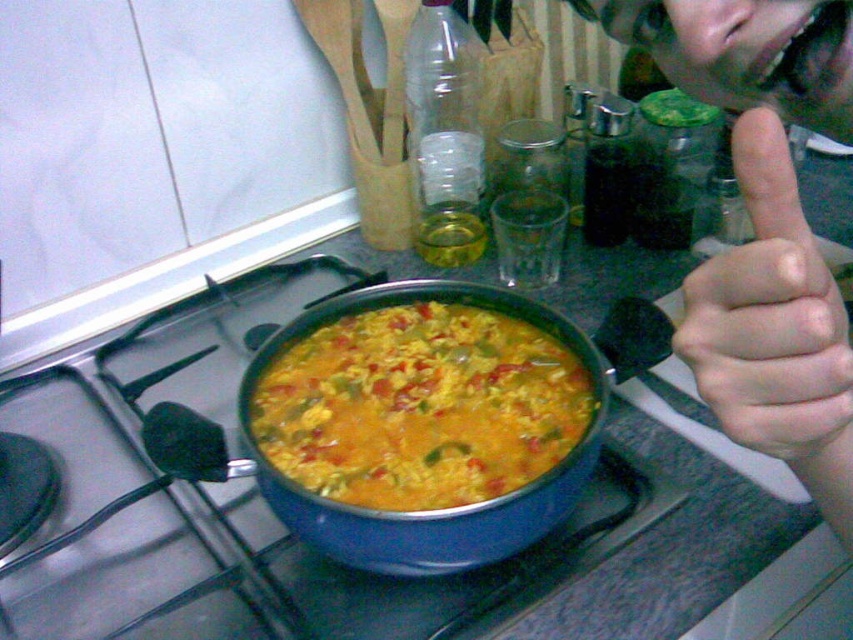
Does yellow matte rice at center come in front of pale skin hand at upper right?

No, yellow matte rice at center is behind pale skin hand at upper right.

Can you confirm if yellow matte rice at center is positioned below pale skin hand at upper right?

Yes, yellow matte rice at center is below pale skin hand at upper right.

Is point (415, 305) farther from camera compared to point (782, 323)?

That is True.

This screenshot has width=853, height=640. Find the location of `yellow matte rice at center`. yellow matte rice at center is located at coordinates (421, 406).

Is blue matte pan at center to the left of pale skin hand at upper right from the viewer's perspective?

Correct, you'll find blue matte pan at center to the left of pale skin hand at upper right.

Which is below, blue matte pan at center or pale skin hand at upper right?

blue matte pan at center

Between point (114, 426) and point (772, 248), which one is positioned behind?

Positioned behind is point (114, 426).

At what (x,y) coordinates should I click in order to perform the action: click on blue matte pan at center. Please return your answer as a coordinate pair (x, y). Looking at the image, I should click on (227, 502).

Between point (97, 362) and point (444, 317), which one is positioned in front?

Point (444, 317)

Is blue matte pan at center taller than yellow matte rice at center?

Indeed, blue matte pan at center has a greater height compared to yellow matte rice at center.

This screenshot has height=640, width=853. Describe the element at coordinates (227, 502) in the screenshot. I see `blue matte pan at center` at that location.

Locate an element on the screen. blue matte pan at center is located at coordinates (227, 502).